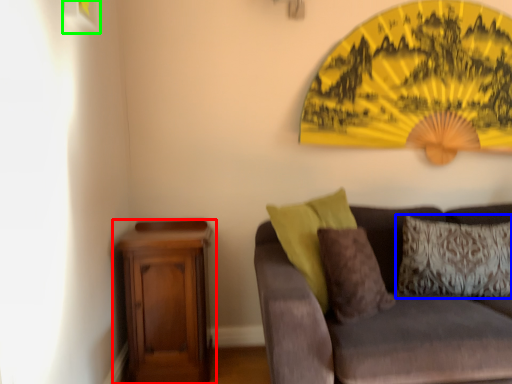
Question: Estimate the real-world distances between objects in this image. Which object is closer to nightstand (highlighted by a red box), pillow (highlighted by a blue box) or picture frame (highlighted by a green box)?

Choices:
 (A) pillow
 (B) picture frame

Answer: (A)